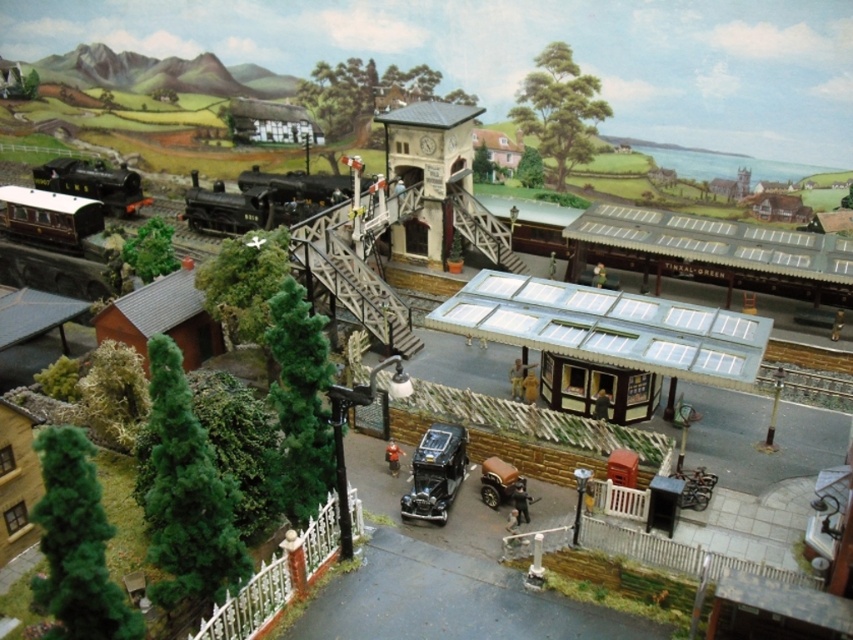
The width and height of the screenshot is (853, 640). What do you see at coordinates (49, 216) in the screenshot?
I see `matte black train at left` at bounding box center [49, 216].

Consider the image. Is matte black train at left positioned before shiny black locomotive at left?

Yes, matte black train at left is in front of shiny black locomotive at left.

Does point (80, 234) come in front of point (73, 166)?

Yes, point (80, 234) is closer to viewer.

Identify the location of matte black train at left. (49, 216).

Based on the photo, between matte black train at left and shiny brown car at center, which one has more height?

With more height is matte black train at left.

Which is behind, point (0, 196) or point (503, 486)?

The point (0, 196) is more distant.

Where is `matte black train at left`? This screenshot has width=853, height=640. matte black train at left is located at coordinates (49, 216).

Which is above, shiny black locomotive at left or shiny brown car at center?

shiny black locomotive at left

Which of these two, shiny black locomotive at left or shiny brown car at center, stands shorter?

shiny brown car at center is shorter.

Who is more forward, (140, 186) or (495, 468)?

Positioned in front is point (495, 468).

Find the location of a particular element. shiny black locomotive at left is located at coordinates (93, 182).